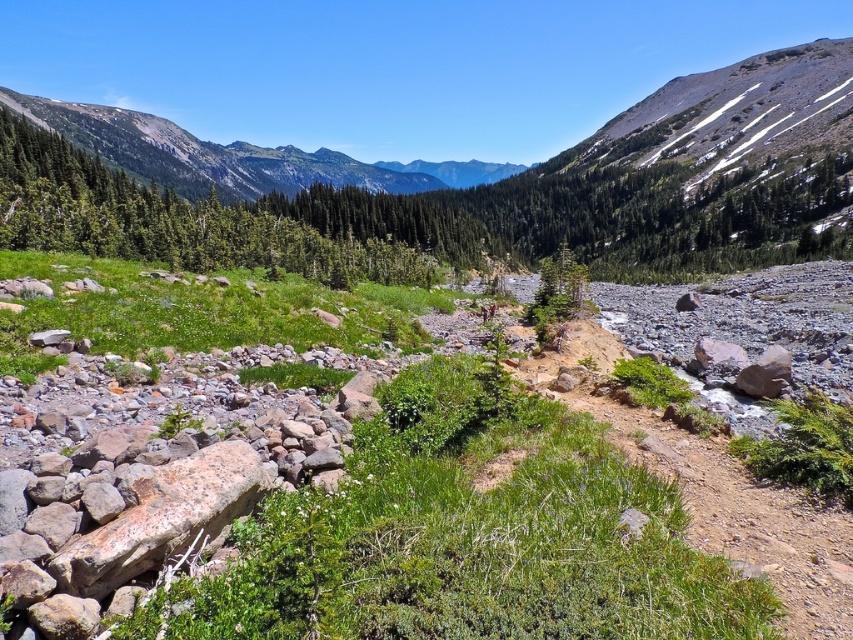
Question: Which object appears closest to the camera in this image?

Choices:
 (A) green leafy tree at upper left
 (B) green forested mountain at upper center

Answer: (A)

Question: Is green leafy tree at upper left to the right of green forested mountain at upper center from the viewer's perspective?

Choices:
 (A) yes
 (B) no

Answer: (A)

Question: Which object appears farthest from the camera in this image?

Choices:
 (A) green forested mountain at upper center
 (B) green leafy tree at upper left

Answer: (A)

Question: Where is green leafy tree at upper left located in relation to green forested mountain at upper center in the image?

Choices:
 (A) right
 (B) left

Answer: (A)

Question: Is green leafy tree at upper left behind green forested mountain at upper center?

Choices:
 (A) no
 (B) yes

Answer: (A)